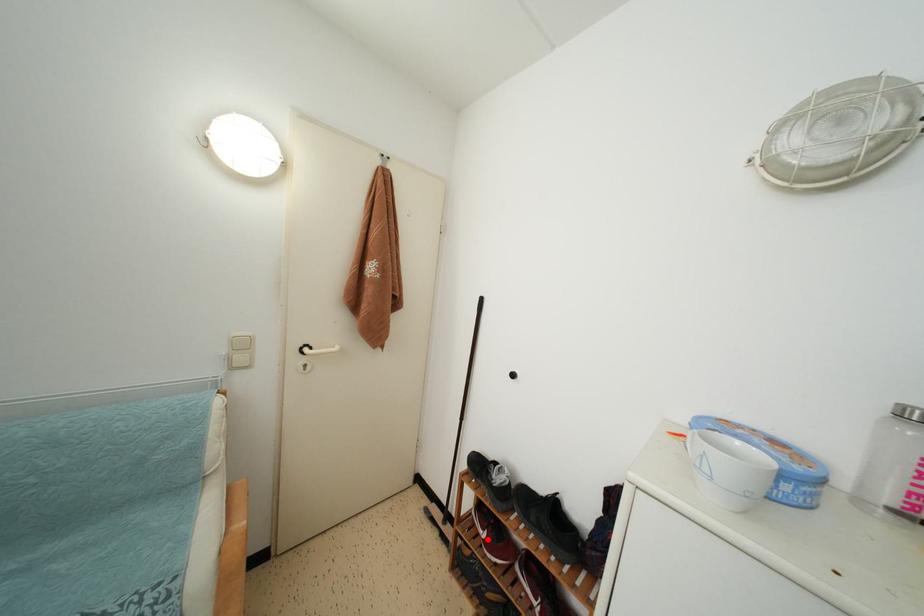
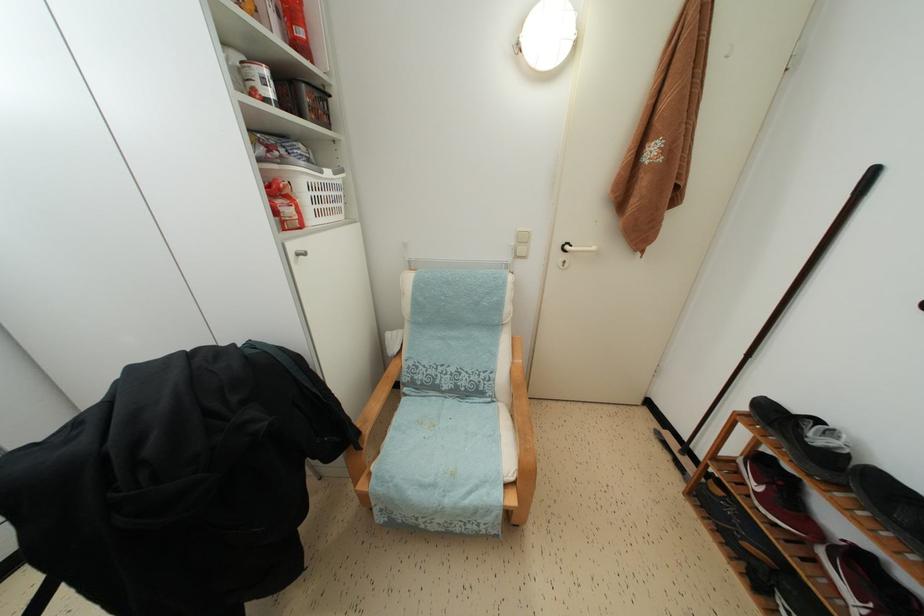
Where in the second image is the point corresponding to the highlighted location from the first image?

(760, 493)